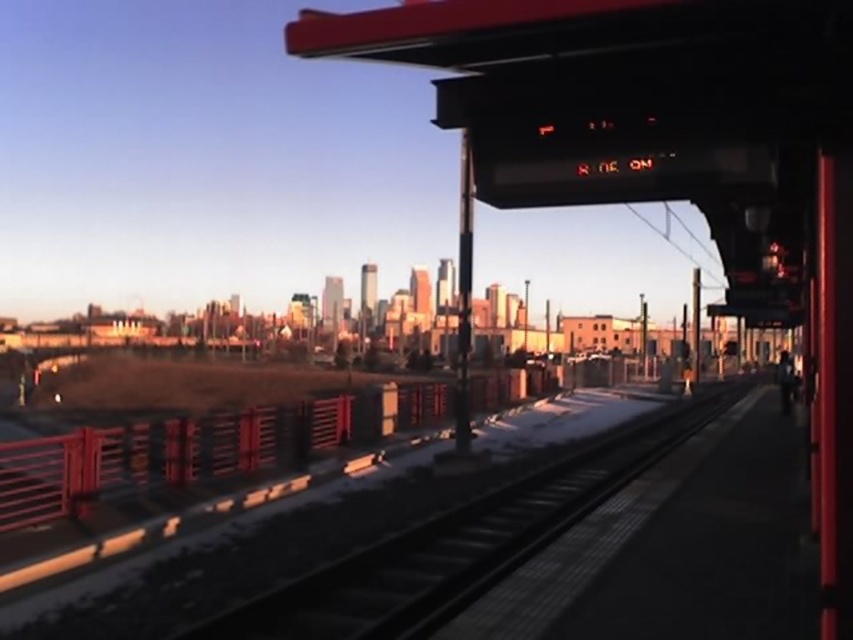
Question: Can you confirm if metallic gray train track at center is positioned below metallic red rail at lower left?

Choices:
 (A) no
 (B) yes

Answer: (A)

Question: Which of the following is the closest to the observer?

Choices:
 (A) (274, 464)
 (B) (506, 573)

Answer: (B)

Question: Is metallic gray train track at center thinner than metallic red rail at lower left?

Choices:
 (A) no
 (B) yes

Answer: (B)

Question: Does metallic gray train track at center have a larger size compared to metallic red rail at lower left?

Choices:
 (A) no
 (B) yes

Answer: (A)

Question: Which point is closer to the camera?

Choices:
 (A) (59, 467)
 (B) (421, 620)

Answer: (B)

Question: Among these objects, which one is nearest to the camera?

Choices:
 (A) metallic red rail at lower left
 (B) metallic gray train track at center

Answer: (B)